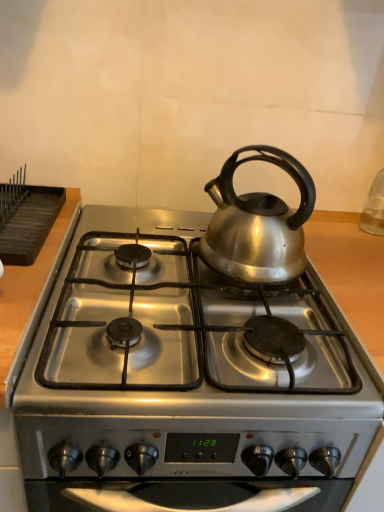
Question: Can you confirm if silver metallic kettle at center is smaller than black matte rack at upper left?

Choices:
 (A) yes
 (B) no

Answer: (B)

Question: Is silver metallic kettle at center placed right next to black matte rack at upper left?

Choices:
 (A) no
 (B) yes

Answer: (A)

Question: Is silver metallic kettle at center completely or partially outside of black matte rack at upper left?

Choices:
 (A) no
 (B) yes

Answer: (B)

Question: Is silver metallic kettle at center far from black matte rack at upper left?

Choices:
 (A) yes
 (B) no

Answer: (B)

Question: Is silver metallic kettle at center bigger than black matte rack at upper left?

Choices:
 (A) no
 (B) yes

Answer: (B)

Question: Is silver metallic kettle at center facing towards black matte rack at upper left?

Choices:
 (A) yes
 (B) no

Answer: (B)

Question: Can you confirm if silver metallic kettle at center is thinner than satin silver gas stove at center?

Choices:
 (A) yes
 (B) no

Answer: (A)

Question: Can you confirm if silver metallic kettle at center is bigger than satin silver gas stove at center?

Choices:
 (A) no
 (B) yes

Answer: (A)

Question: Is silver metallic kettle at center located outside satin silver gas stove at center?

Choices:
 (A) no
 (B) yes

Answer: (B)

Question: Considering the relative positions of silver metallic kettle at center and satin silver gas stove at center in the image provided, is silver metallic kettle at center to the right of satin silver gas stove at center from the viewer's perspective?

Choices:
 (A) no
 (B) yes

Answer: (B)

Question: Considering the relative positions of silver metallic kettle at center and satin silver gas stove at center in the image provided, is silver metallic kettle at center in front of satin silver gas stove at center?

Choices:
 (A) yes
 (B) no

Answer: (B)

Question: From the image's perspective, is silver metallic kettle at center under satin silver gas stove at center?

Choices:
 (A) yes
 (B) no

Answer: (B)

Question: Can you confirm if black matte rack at upper left is smaller than silver metallic kettle at center?

Choices:
 (A) no
 (B) yes

Answer: (B)